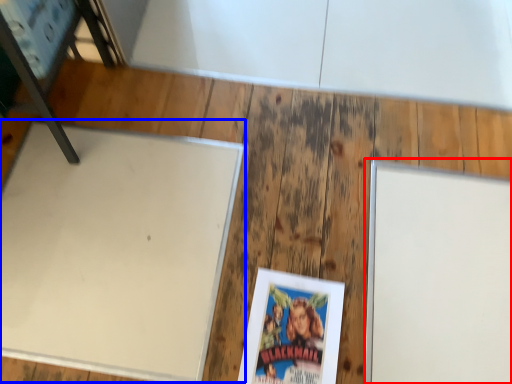
Question: Which of the following is the farthest to the observer, bulletin board (highlighted by a red box) or table (highlighted by a blue box)?

Choices:
 (A) bulletin board
 (B) table

Answer: (B)